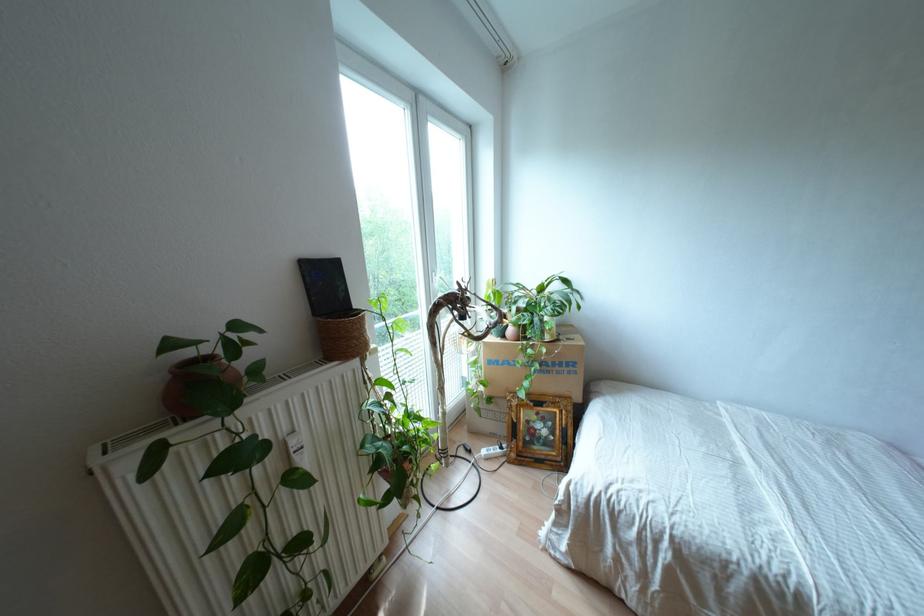
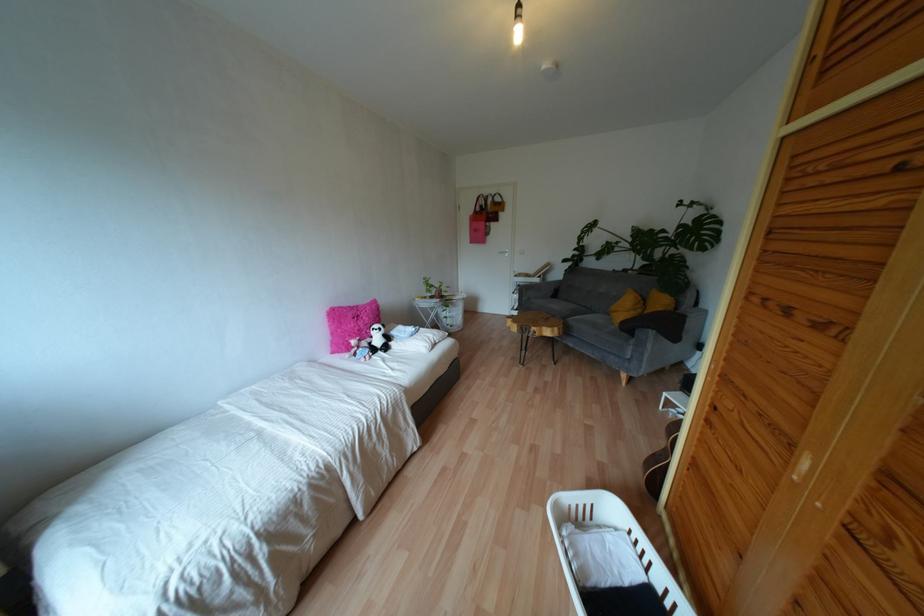
First-person continuous shooting, in which direction is the camera rotating?

The rotation direction of the camera is right-down.